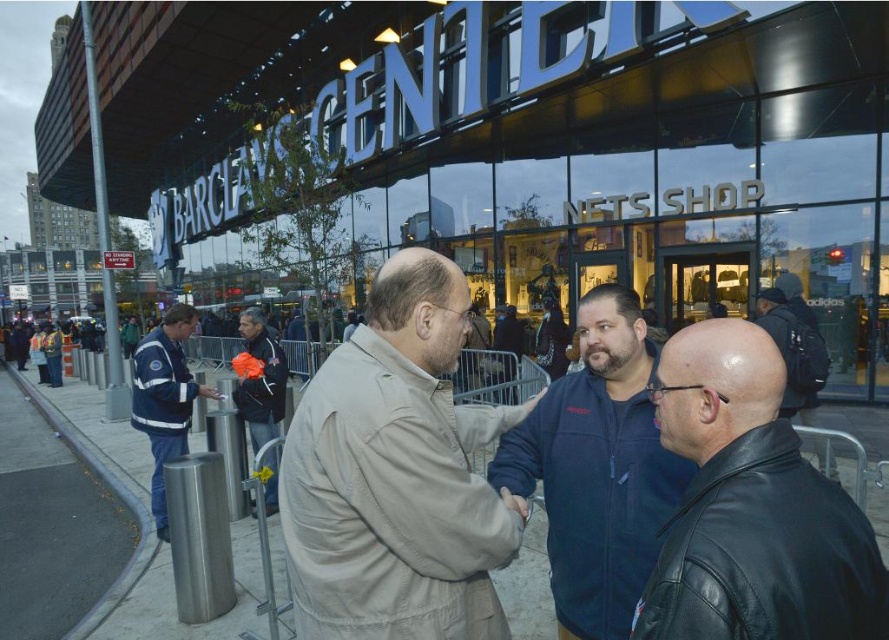
Question: Is black leather jacket at lower right above black leather jacket at center?

Choices:
 (A) yes
 (B) no

Answer: (B)

Question: Which object appears closest to the camera in this image?

Choices:
 (A) black leather jacket at lower right
 (B) blue reflective jacket at left

Answer: (A)

Question: Which point is closer to the camera?

Choices:
 (A) orange fleece jacket at center
 (B) blue reflective jacket at left
 (C) beige fabric jacket at center
 (D) black leather jacket at lower right

Answer: (D)

Question: Which object is closer to the camera taking this photo?

Choices:
 (A) beige fabric jacket at center
 (B) blue reflective jacket at left
 (C) black leather jacket at center
 (D) dark blue fleece jacket at center

Answer: (A)

Question: Considering the relative positions of blue reflective jacket at left and black leather jacket at center in the image provided, where is blue reflective jacket at left located with respect to black leather jacket at center?

Choices:
 (A) left
 (B) right

Answer: (A)

Question: Does beige fabric jacket at center appear under blue reflective jacket at left?

Choices:
 (A) yes
 (B) no

Answer: (B)